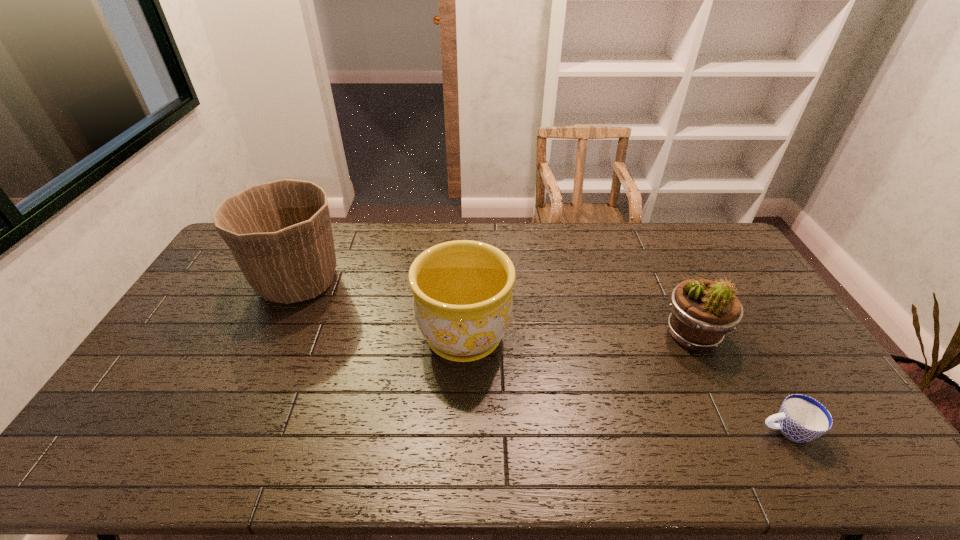
What are the coordinates of `free space located 0.330m on the side of the shortest object with the handle` in the screenshot? It's located at (628, 430).

Find the location of `vacant space situated 0.150m on the side of the shortest object with the handle`. vacant space situated 0.150m on the side of the shortest object with the handle is located at coordinates (700, 430).

Identify the location of object present at the far edge. (280, 234).

Locate an element on the screen. object located at the near edge is located at coordinates coord(801,418).

Where is `object present at the left edge`? object present at the left edge is located at coordinates (280, 234).

Find the location of a particular element. object that is at the right edge is located at coordinates (801, 418).

The image size is (960, 540). I want to click on object that is positioned at the far left corner, so click(280, 234).

In order to click on object that is at the near right corner in this screenshot , I will do `click(801, 418)`.

The width and height of the screenshot is (960, 540). I want to click on free spot at the far edge of the desktop, so click(x=398, y=237).

Image resolution: width=960 pixels, height=540 pixels. Find the location of `free space at the near edge of the desktop`. free space at the near edge of the desktop is located at coordinates (408, 470).